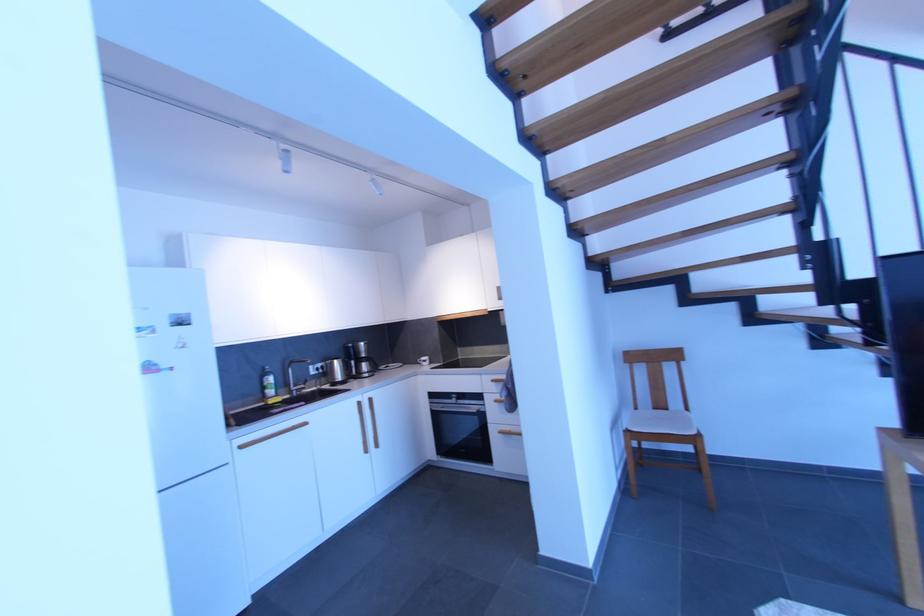
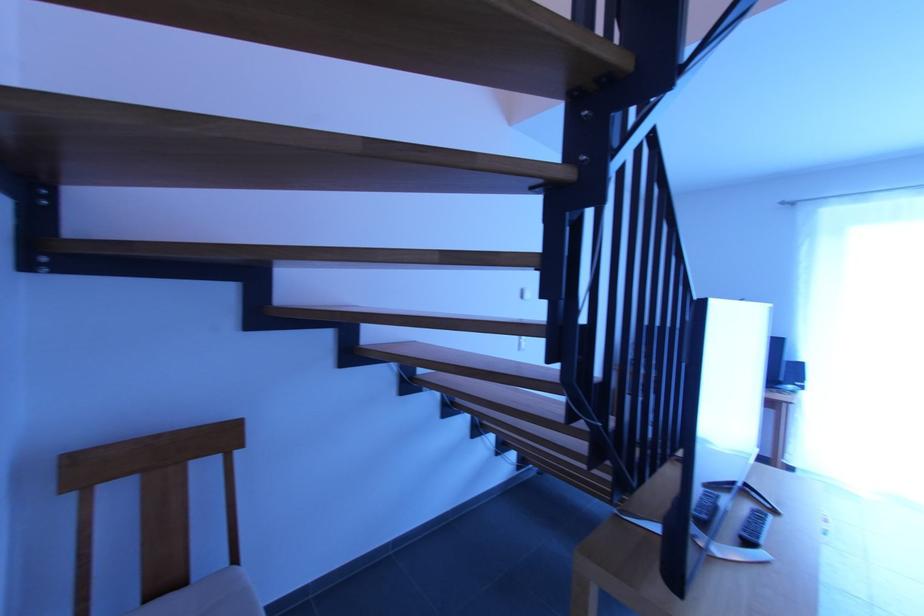
In the second image, find the point that corresponds to [672,411] in the first image.

(189, 584)